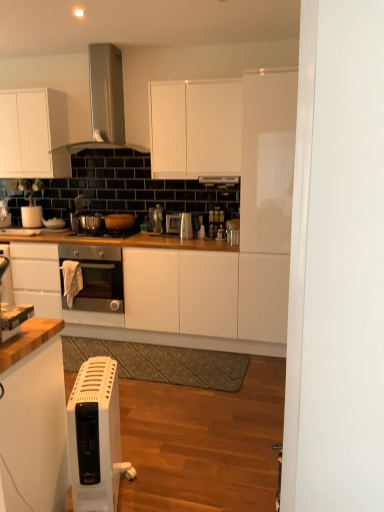
You are a GUI agent. You are given a task and a screenshot of the screen. Output one action in this format:
    pyautogui.click(x=<x>, y=<y>)
    Task: Click on the free space above satin silver kettle at center, placed as the sixth appliance when sorted from left to right (from a real-world perspective)
    
    Given the screenshot: What is the action you would take?
    pyautogui.click(x=183, y=212)